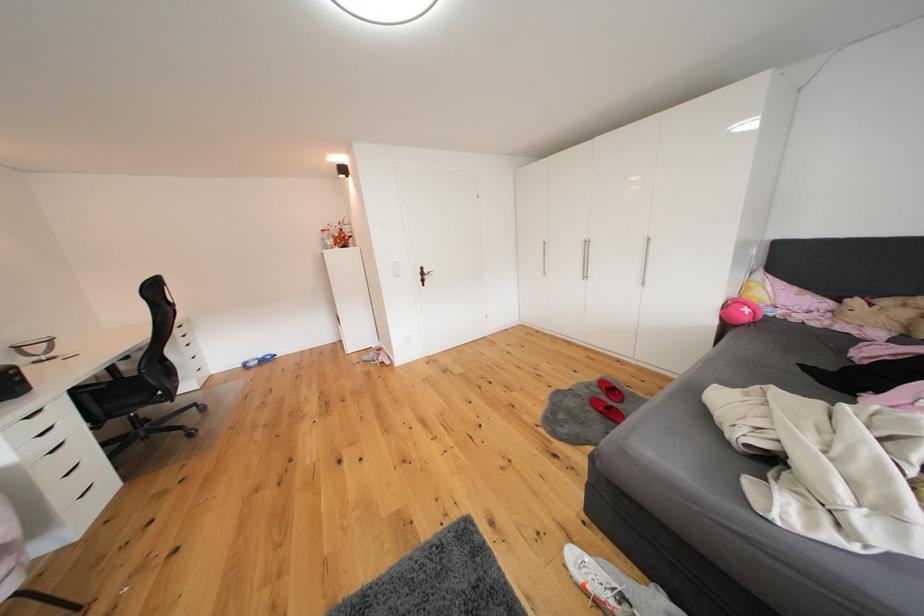
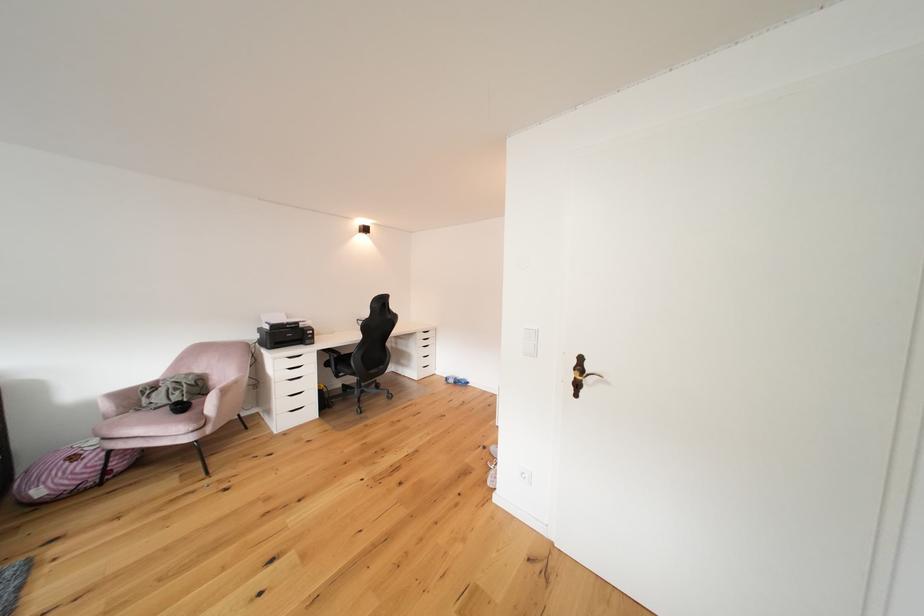
Locate, in the second image, the point that corresponds to point (430, 281) in the first image.

(580, 379)